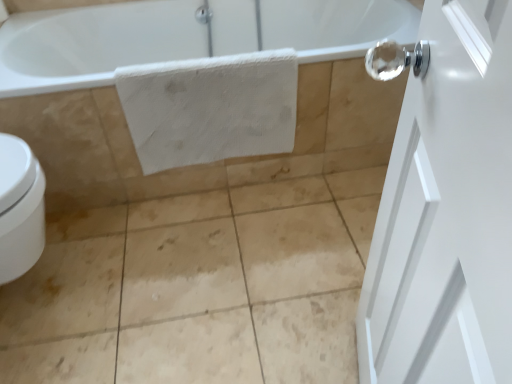
The height and width of the screenshot is (384, 512). Identify the location of white textured towel at center. (210, 108).

Describe the element at coordinates (210, 108) in the screenshot. The width and height of the screenshot is (512, 384). I see `white textured towel at center` at that location.

What is the approximate height of white matte door at right?

white matte door at right is 30.77 inches tall.

Where is `white matte door at right`? white matte door at right is located at coordinates (445, 209).

The image size is (512, 384). What do you see at coordinates (445, 209) in the screenshot? I see `white matte door at right` at bounding box center [445, 209].

In order to face white matte door at right, should I rotate leftwards or rightwards?

Turn right by 15.336 degrees to look at white matte door at right.

Find the location of `white textured towel at center`. white textured towel at center is located at coordinates (210, 108).

Considering the positions of objects white textured towel at center and white matte door at right in the image provided, who is more to the right, white textured towel at center or white matte door at right?

Positioned to the right is white matte door at right.

Is white textured towel at center positioned behind white matte door at right?

Yes, it is behind white matte door at right.

Which is in front, point (205, 81) or point (404, 56)?

The point (404, 56) is closer to the camera.

From the image's perspective, is white textured towel at center located above white matte door at right?

Yes, from the image's perspective, white textured towel at center is over white matte door at right.

From a real-world perspective, is white textured towel at center below white matte door at right?

Yes, from a real-world perspective, white textured towel at center is beneath white matte door at right.

Is white textured towel at center wider or thinner than white matte door at right?

Clearly, white textured towel at center has less width compared to white matte door at right.

Considering the relative sizes of white textured towel at center and white matte door at right in the image provided, is white textured towel at center shorter than white matte door at right?

Correct, white textured towel at center is not as tall as white matte door at right.

From the picture: Between white textured towel at center and white matte door at right, which one has smaller size?

white textured towel at center is smaller.

In the scene shown: Is white textured towel at center spatially inside white matte door at right, or outside of it?

white textured towel at center is spatially situated outside white matte door at right.

In the scene shown: Is white textured towel at center positioned far away from white matte door at right?

No, there isn't a large distance between white textured towel at center and white matte door at right.

Is white textured towel at center oriented towards white matte door at right?

Yes, white textured towel at center is facing white matte door at right.

Can you tell me how much white textured towel at center and white matte door at right differ in facing direction?

107 degrees separate the facing orientations of white textured towel at center and white matte door at right.

Where is `door that appears in front of the white textured towel at center`? The width and height of the screenshot is (512, 384). door that appears in front of the white textured towel at center is located at coordinates (445, 209).

Considering the relative positions of white matte door at right and white textured towel at center in the image provided, is white matte door at right to the right of white textured towel at center from the viewer's perspective?

Correct, you'll find white matte door at right to the right of white textured towel at center.

In the image, is white matte door at right positioned in front of or behind white textured towel at center?

Clearly, white matte door at right is in front of white textured towel at center.

Is point (503, 127) closer to camera compared to point (148, 159)?

Yes, point (503, 127) is closer to viewer.

From the image's perspective, is white matte door at right located above or below white textured towel at center?

white matte door at right is below white textured towel at center.

From a real-world perspective, between white matte door at right and white textured towel at center, who is vertically lower?

white textured towel at center.

Looking at their sizes, would you say white matte door at right is wider or thinner than white textured towel at center?

In the image, white matte door at right appears to be wider than white textured towel at center.

Considering the sizes of white matte door at right and white textured towel at center in the image, is white matte door at right taller or shorter than white textured towel at center?

white matte door at right is taller than white textured towel at center.

Considering the sizes of objects white matte door at right and white textured towel at center in the image provided, who is bigger, white matte door at right or white textured towel at center?

white matte door at right.

Is white textured towel at center completely or partially inside white matte door at right?

No, white matte door at right does not contain white textured towel at center.

Is white matte door at right directly adjacent to white textured towel at center?

No, white matte door at right is not with white textured towel at center.

Is white textured towel at center at the back of white matte door at right?

white matte door at right is not turned away from white textured towel at center.

You are a GUI agent. You are given a task and a screenshot of the screen. Output one action in this format:
    pyautogui.click(x=<x>, y=<y>)
    Task: Click on the door above the white textured towel at center (from a real-world perspective)
    This screenshot has height=384, width=512.
    Given the screenshot: What is the action you would take?
    pyautogui.click(x=445, y=209)

The width and height of the screenshot is (512, 384). I want to click on door below the white textured towel at center (from the image's perspective), so click(x=445, y=209).

At what (x,y) coordinates should I click in order to perform the action: click on door that appears above the white textured towel at center (from a real-world perspective). Please return your answer as a coordinate pair (x, y). Looking at the image, I should click on (445, 209).